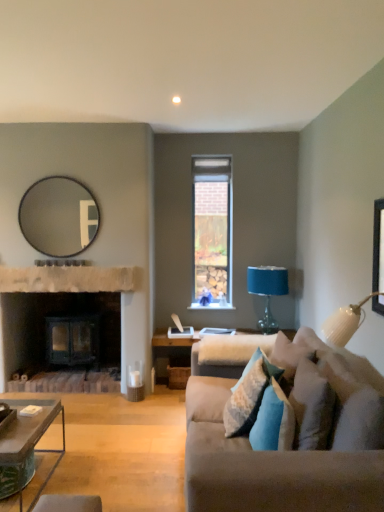
Locate an element on the screen. blank space situated above matte black mirror at upper left (from a real-world perspective) is located at coordinates (61, 176).